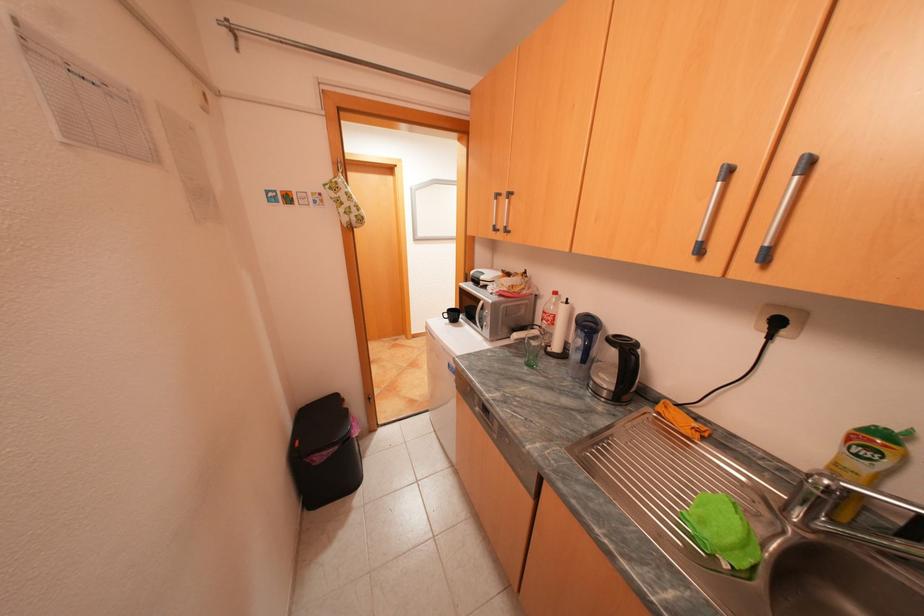
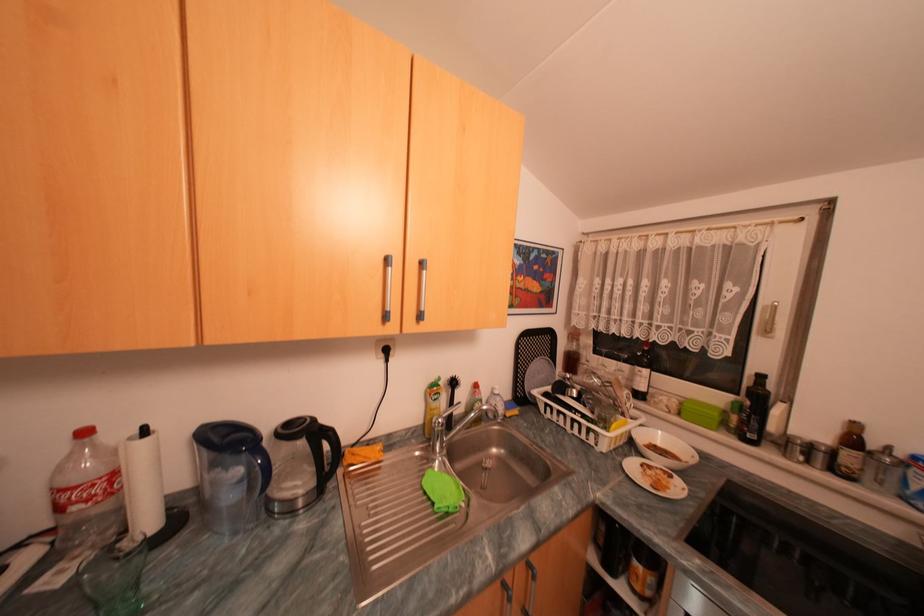
Question: The images are taken continuously from a first-person perspective. In which direction is your viewpoint rotating?

Choices:
 (A) Left
 (B) Right
 (C) Up
 (D) Down

Answer: (B)